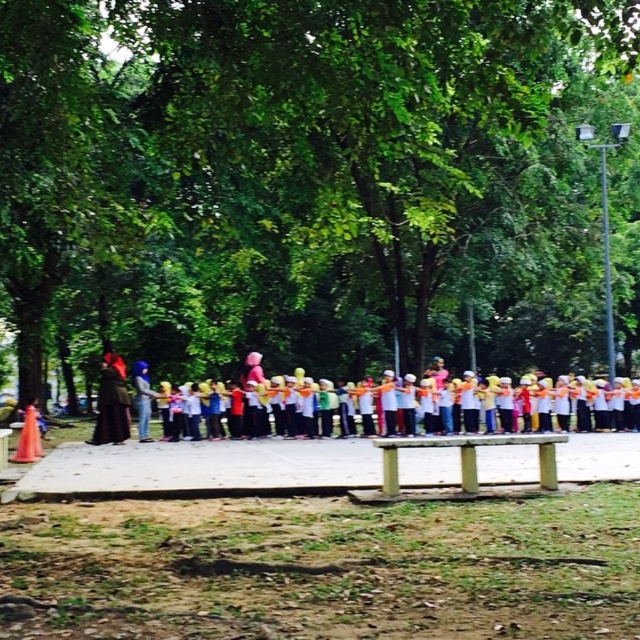
Can you confirm if brown wooden picnic table at center is positioned to the right of dark brown fabric at left?

Indeed, brown wooden picnic table at center is positioned on the right side of dark brown fabric at left.

Is brown wooden picnic table at center bigger than dark brown fabric at left?

Incorrect, brown wooden picnic table at center is not larger than dark brown fabric at left.

Who is more distant from viewer, (390,492) or (108,358)?

The point (108,358) is behind.

Locate an element on the screen. This screenshot has width=640, height=640. brown wooden picnic table at center is located at coordinates (468, 456).

Does green leafy tree at upper center have a greater height compared to white cotton scarf at center?

Indeed, green leafy tree at upper center has a greater height compared to white cotton scarf at center.

Which is behind, point (168, 288) or point (625, 401)?

The point (168, 288) is behind.

I want to click on green leafy tree at upper center, so click(317, 182).

Which is above, green leafy tree at upper center or brown wooden picnic table at center?

green leafy tree at upper center is higher up.

Is green leafy tree at upper center wider than brown wooden picnic table at center?

Yes.

Is point (426, 307) positioned in front of point (557, 436)?

No, it is behind (557, 436).

At what (x,y) coordinates should I click in order to perform the action: click on green leafy tree at upper center. Please return your answer as a coordinate pair (x, y). This screenshot has height=640, width=640. Looking at the image, I should click on [x=317, y=182].